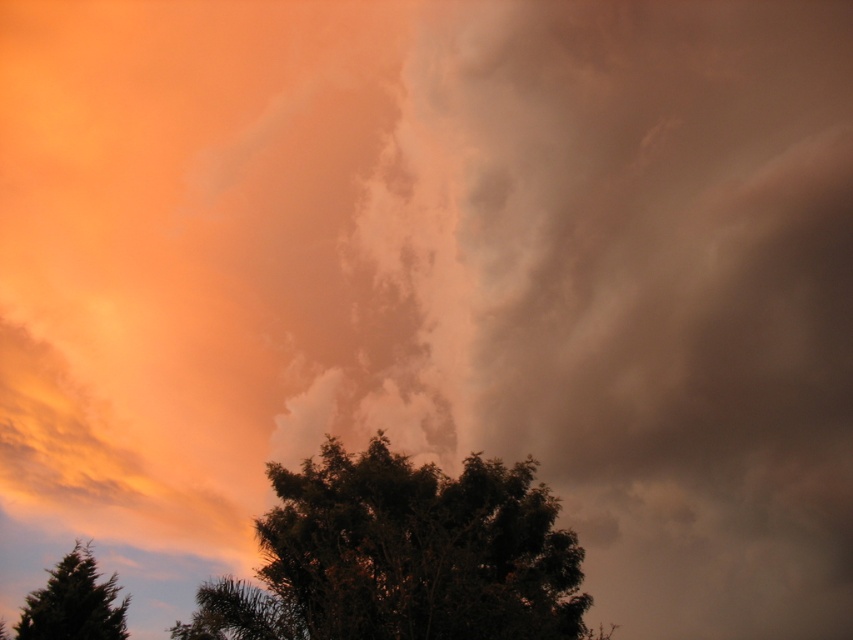
Question: Among these objects, which one is farthest from the camera?

Choices:
 (A) green matte tree at lower left
 (B) green leafy tree at lower center

Answer: (A)

Question: Is green leafy tree at lower center below green matte tree at lower left?

Choices:
 (A) no
 (B) yes

Answer: (A)

Question: Can you confirm if green leafy tree at lower center is positioned below green matte tree at lower left?

Choices:
 (A) no
 (B) yes

Answer: (A)

Question: Among these points, which one is farthest from the camera?

Choices:
 (A) (561, 596)
 (B) (94, 602)

Answer: (B)

Question: Is green leafy tree at lower center closer to the viewer compared to green matte tree at lower left?

Choices:
 (A) no
 (B) yes

Answer: (B)